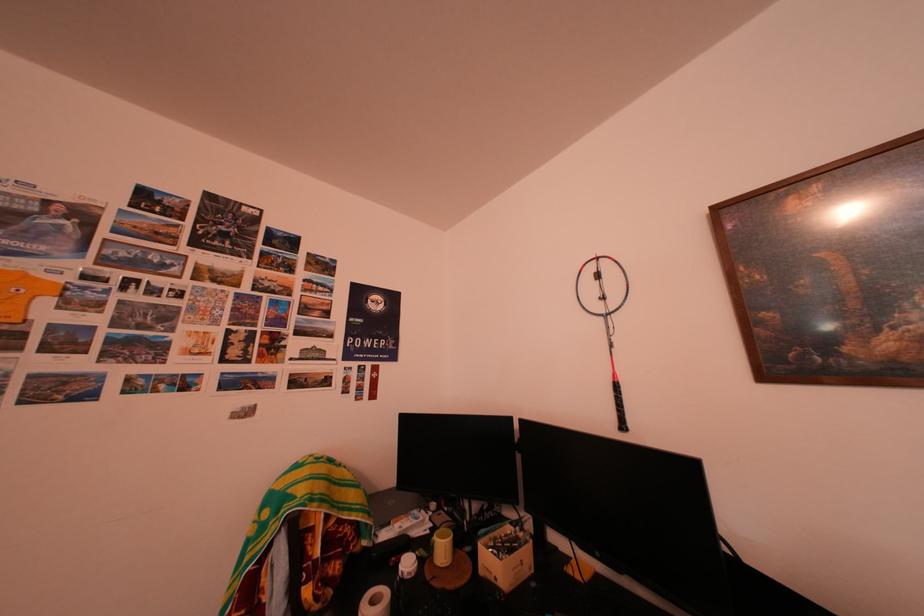
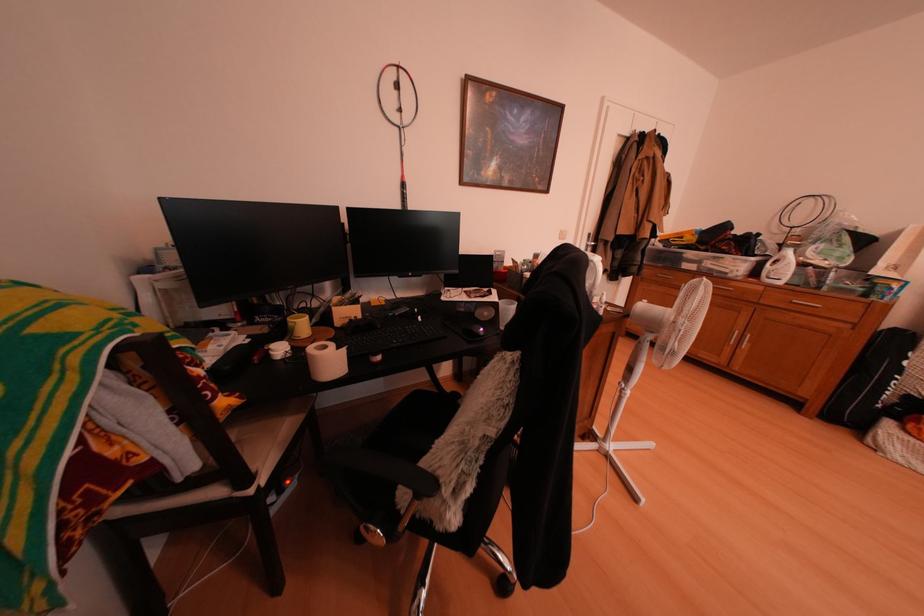
How did the camera likely rotate?

The camera's rotation is toward right-down.